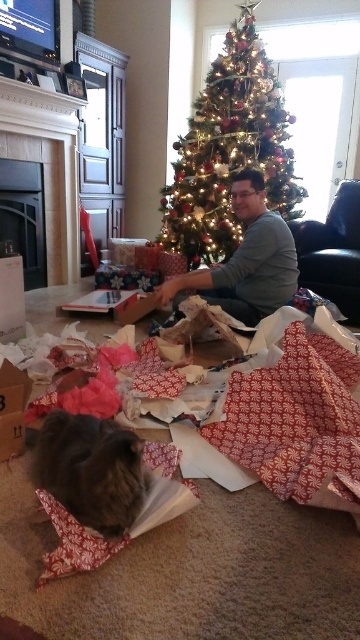
You are a photographer standing in the scene. You want to take a photo of the fluffy gray cat at lower left without moving any objects. Can you position yourself so that the camera is exactly 3.57 feet away from the cat?

Yes, the photographer can position themselves so that the camera is exactly 3.57 feet away from the fluffy gray cat at lower left since the distance between them is specified as 3.57 feet.